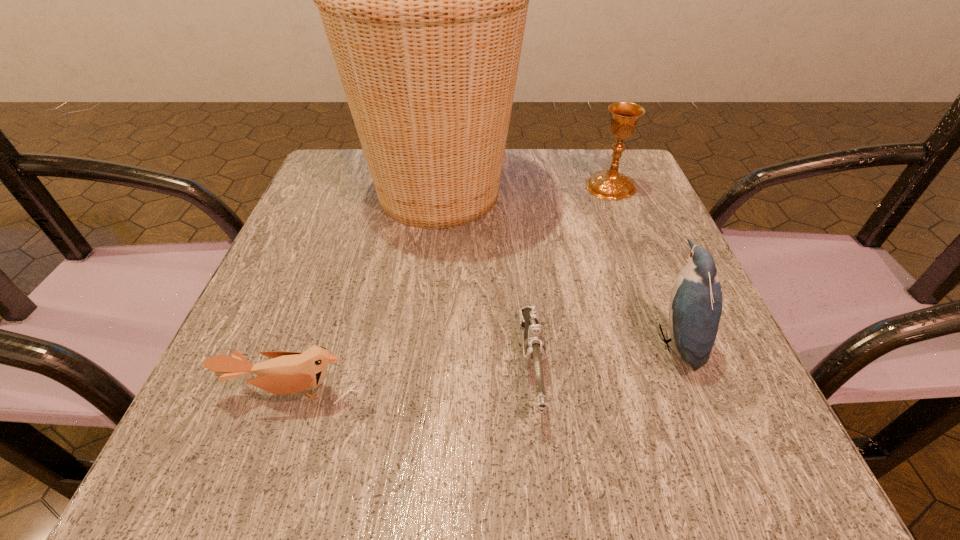
In order to click on free space located 0.070m at the beak of the left bird in this screenshot , I will do `click(268, 462)`.

Locate an element on the screen. The height and width of the screenshot is (540, 960). basket situated at the far edge is located at coordinates (423, 0).

Identify the location of chalice that is at the far edge. Image resolution: width=960 pixels, height=540 pixels. (610, 184).

Locate an element on the screen. This screenshot has height=540, width=960. object that is at the near edge is located at coordinates click(x=534, y=345).

Locate an element on the screen. basket at the left edge is located at coordinates (423, 0).

What are the coordinates of `bird that is at the left edge` in the screenshot? It's located at (288, 372).

You are a GUI agent. You are given a task and a screenshot of the screen. Output one action in this format:
    pyautogui.click(x=<x>, y=<y>)
    Task: Click on the chalice situated at the right edge
    
    Given the screenshot: What is the action you would take?
    pyautogui.click(x=610, y=184)

Find the location of a particular element. bird that is at the right edge is located at coordinates (695, 310).

Image resolution: width=960 pixels, height=540 pixels. Find the location of `object located in the far left corner section of the desktop`. object located in the far left corner section of the desktop is located at coordinates (423, 0).

In order to click on object that is at the far right corner in this screenshot , I will do `click(610, 184)`.